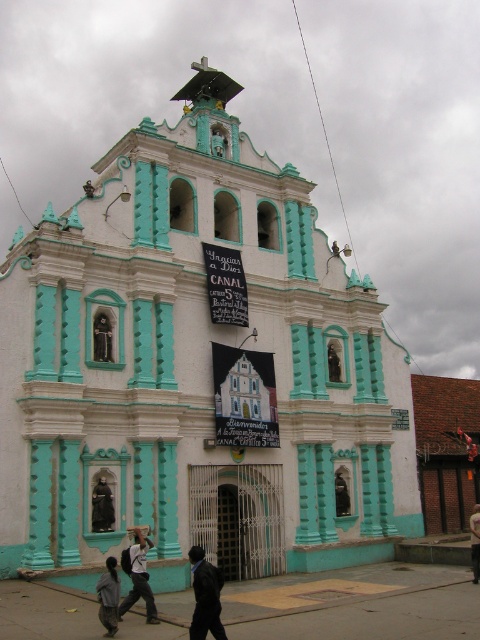
You are standing in front of the church and see the black matte jacket at lower center and the matte black statue at lower left. Which object is closer to your right side?

The black matte jacket at lower center is closer to your right side because it is positioned to the right of the matte black statue at lower left.